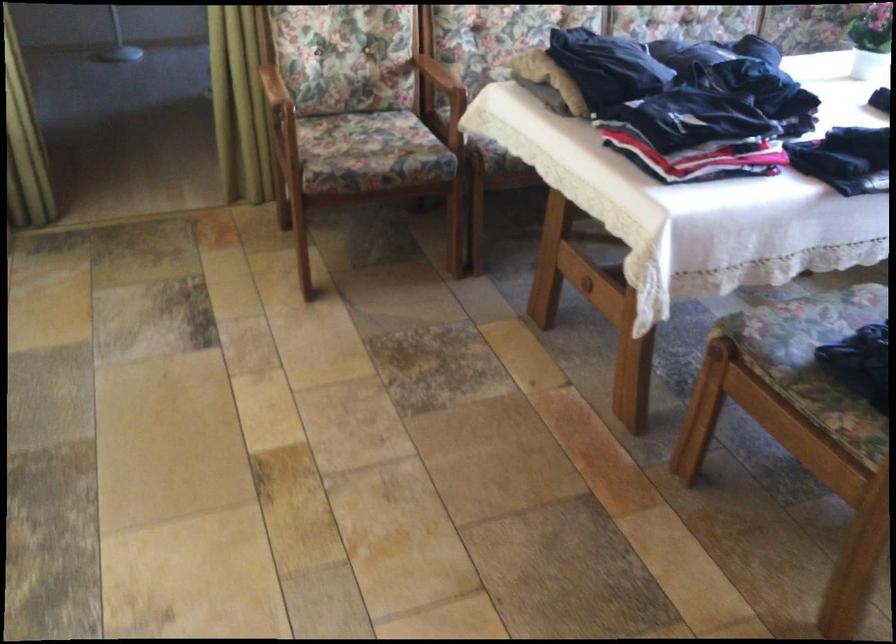
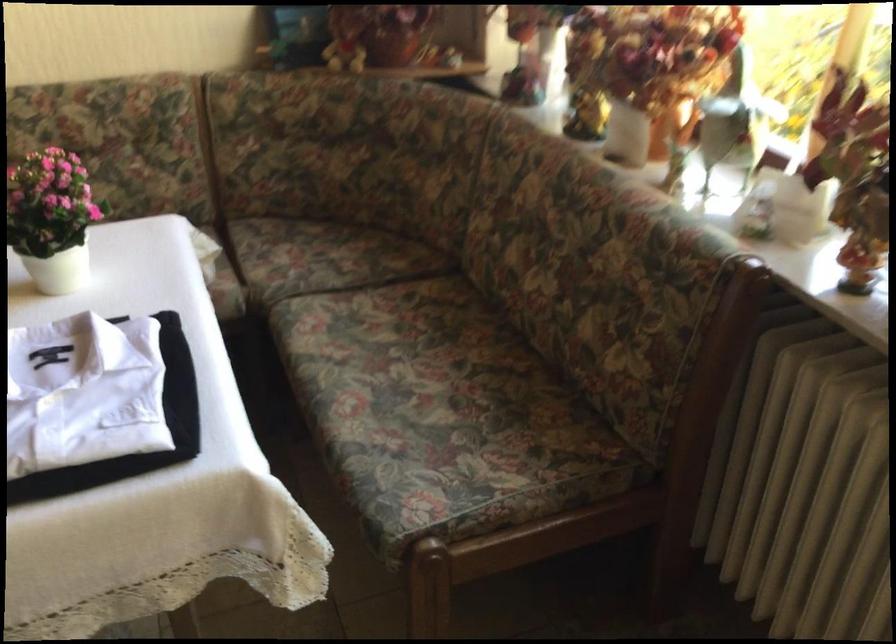
Based on the photo, what movement of the cameraman would produce the second image?

The cameraman walked toward right, forward.